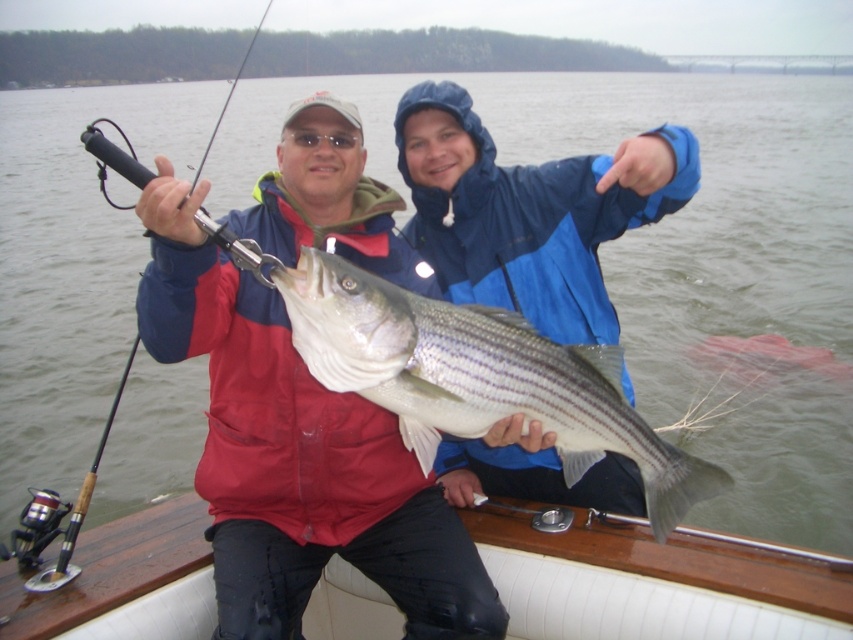
You are designing a life vest for the two people on the boat. The life vest must fit over their existing jackets. Which jacket requires a wider life vest, the matte red jacket at center or the blue waterproof jacket at upper center?

The matte red jacket at center requires a wider life vest because its width surpasses that of the blue waterproof jacket at upper center.

You are a photographer on the boat and want to take a photo of the matte red jacket at center and the white glossy fish at center. Since you have a camera with a fixed focal length, you need to know which object is wider to ensure proper framing. Can you determine which one is wider?

The white glossy fish at center is wider than the matte red jacket at center, so you should frame the white glossy fish at center first to ensure it fits properly in the photo.